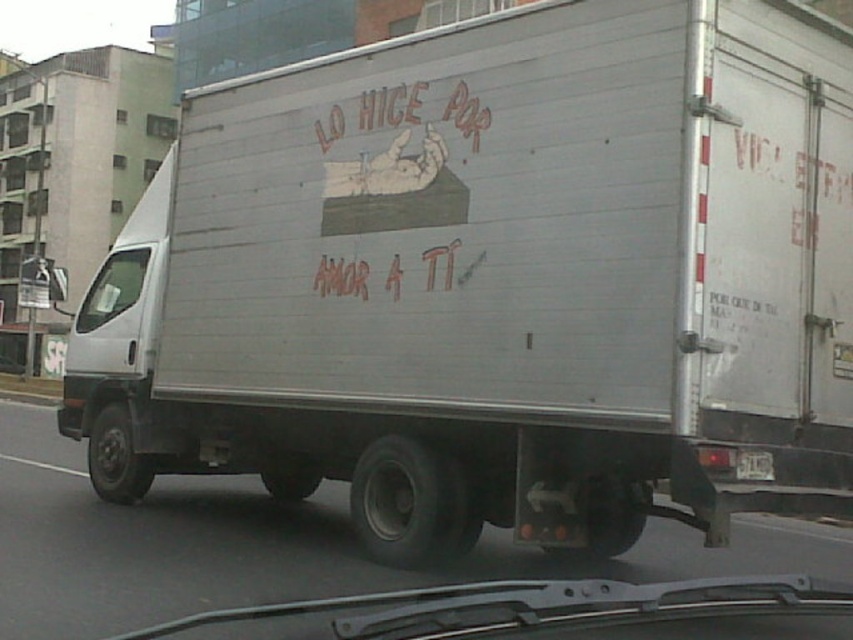
Question: Is transparent glass windshield at left further to camera compared to white plastic license plate at center?

Choices:
 (A) no
 (B) yes

Answer: (B)

Question: Is transparent glass windshield at left thinner than white plastic license plate at center?

Choices:
 (A) yes
 (B) no

Answer: (B)

Question: Which object is farther from the camera taking this photo?

Choices:
 (A) transparent glass windshield at left
 (B) white plastic license plate at center

Answer: (A)

Question: Can you confirm if transparent glass windshield at left is thinner than white plastic license plate at center?

Choices:
 (A) yes
 (B) no

Answer: (B)

Question: Which point is closer to the camera taking this photo?

Choices:
 (A) (735, 468)
 (B) (142, 260)

Answer: (A)